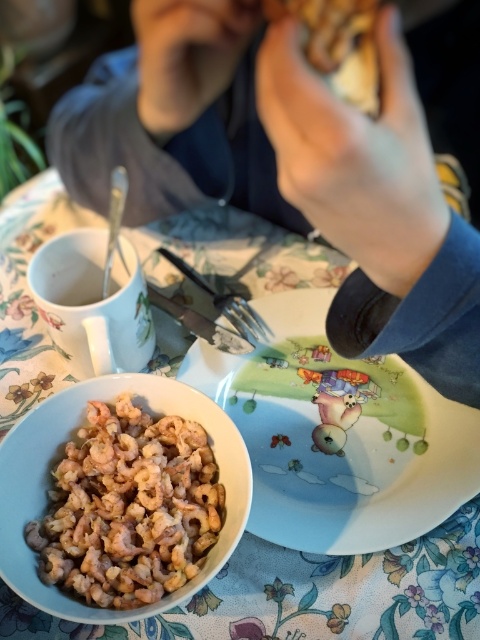
Question: Can you confirm if floral fabric tablecloth at lower center is positioned to the left of pinkish matte shrimp at center?

Choices:
 (A) yes
 (B) no

Answer: (B)

Question: Which point appears farthest from the camera in this image?

Choices:
 (A) (134, 116)
 (B) (120, 436)

Answer: (A)

Question: Which object appears closest to the camera in this image?

Choices:
 (A) pinkish matte shrimp at center
 (B) matte ceramic plate at center
 (C) floral fabric tablecloth at lower center
 (D) silver metallic fork at center

Answer: (A)

Question: Can you confirm if floral fabric tablecloth at lower center is positioned to the left of silver metallic fork at center?

Choices:
 (A) no
 (B) yes

Answer: (B)

Question: Which point is closer to the camera?

Choices:
 (A) pinkish matte shrimp at center
 (B) smooth skin hand at upper right
 (C) silver metallic fork at center
 (D) matte ceramic plate at center

Answer: (B)

Question: Is smooth skin hand at upper right to the left of silver metallic fork at center from the viewer's perspective?

Choices:
 (A) no
 (B) yes

Answer: (A)